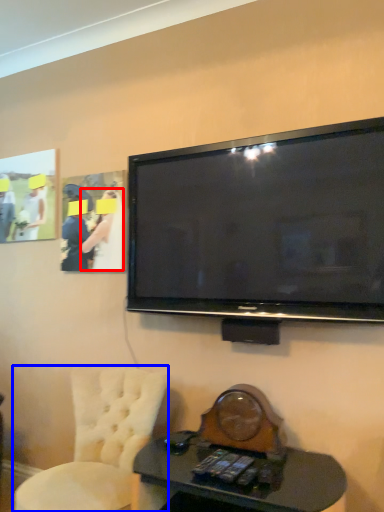
Question: Among these objects, which one is farthest to the camera, person (highlighted by a red box) or chair (highlighted by a blue box)?

Choices:
 (A) person
 (B) chair

Answer: (A)